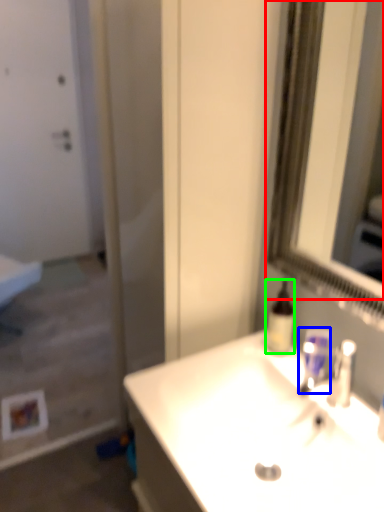
Question: Considering the real-world distances, which object is closest to mirror (highlighted by a red box)? mouthwash (highlighted by a blue box) or mouthwash (highlighted by a green box).

Choices:
 (A) mouthwash
 (B) mouthwash

Answer: (B)